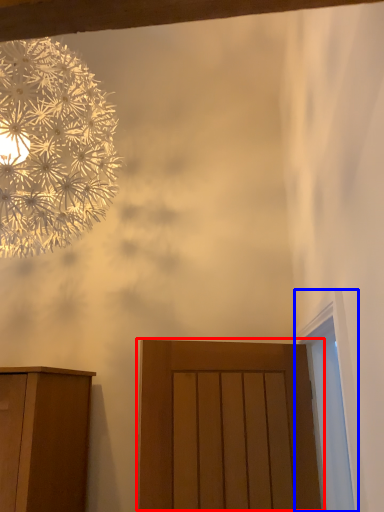
Question: Which object is closer to the camera taking this photo, door (highlighted by a red box) or window (highlighted by a blue box)?

Choices:
 (A) door
 (B) window

Answer: (B)